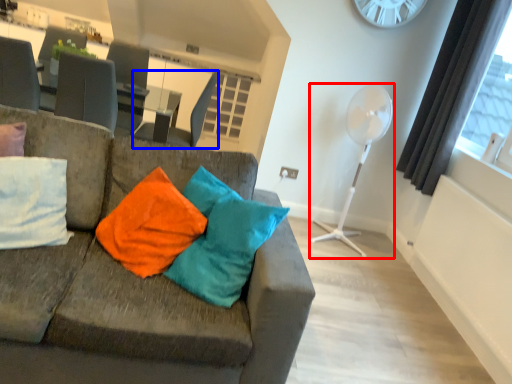
Question: Which point is further to the camera, fan (highlighted by a red box) or swivel chair (highlighted by a blue box)?

Choices:
 (A) fan
 (B) swivel chair

Answer: (B)